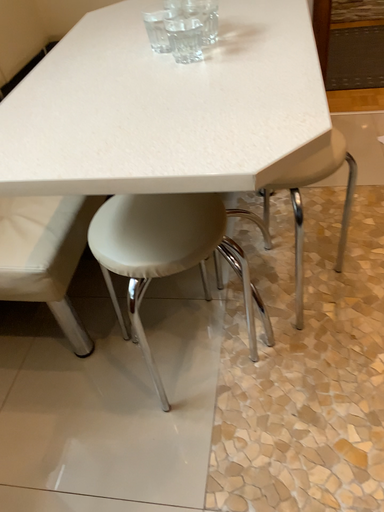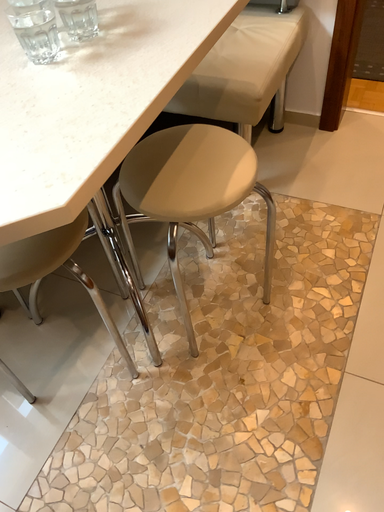
Question: Which way did the camera rotate in the video?

Choices:
 (A) rotated downward
 (B) rotated upward

Answer: (A)